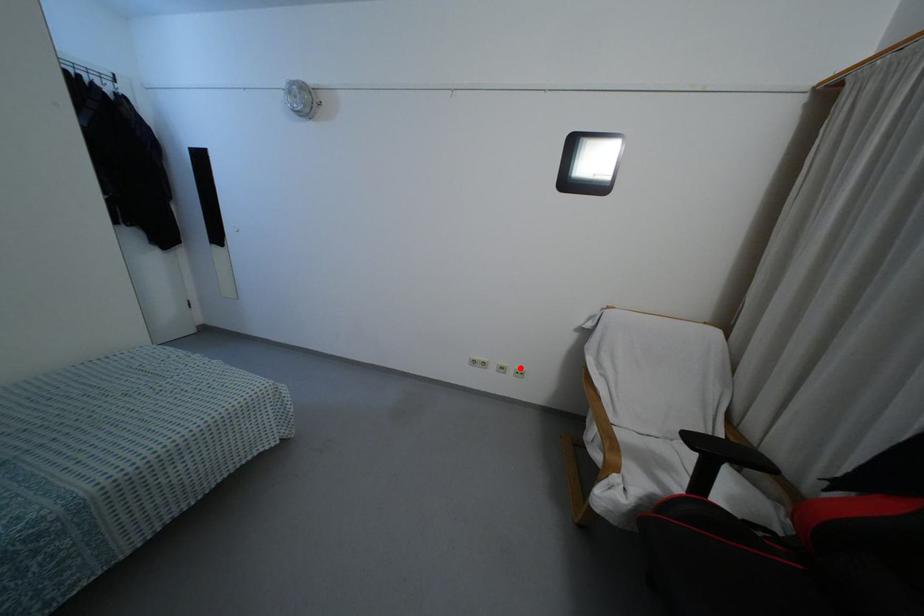
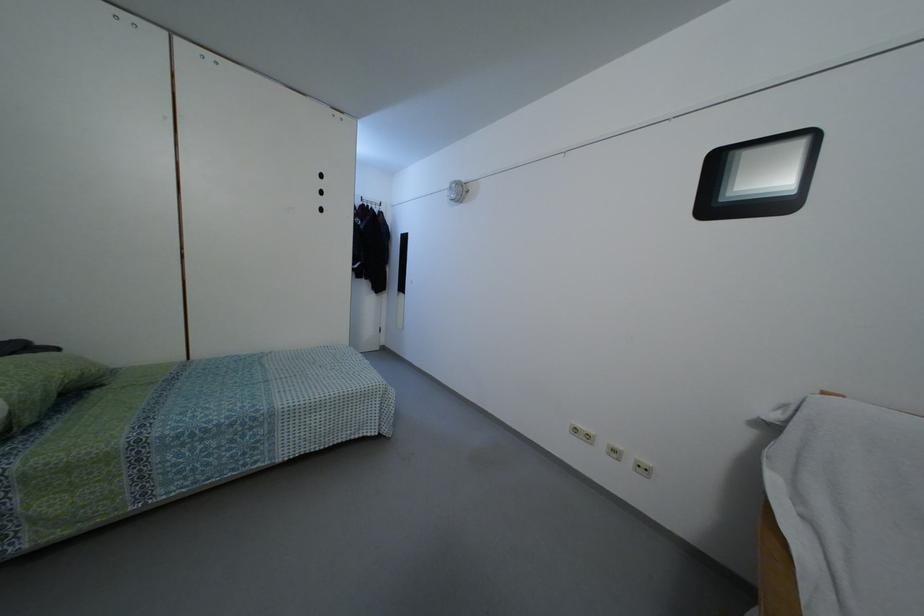
The point at the highlighted location is marked in the first image. Where is the corresponding point in the second image?

(646, 461)